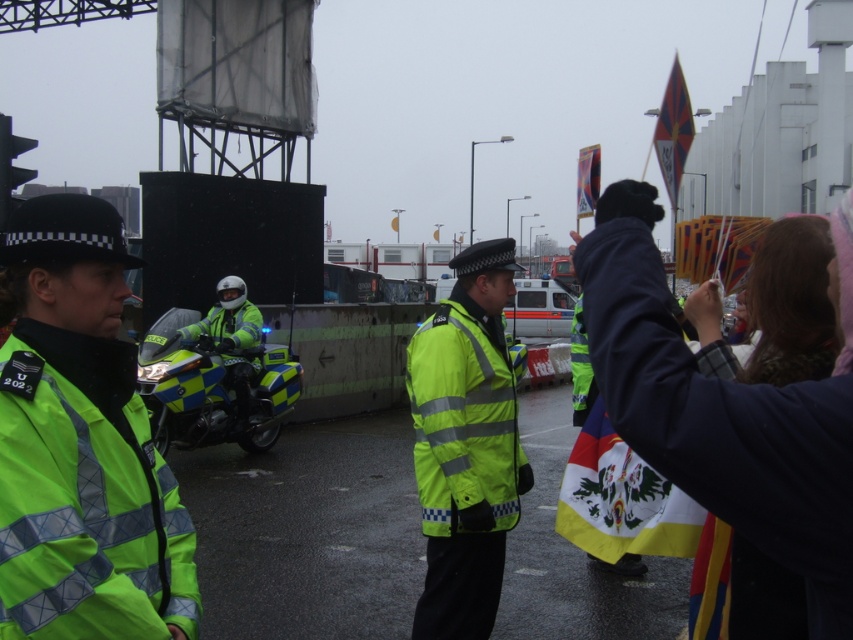
Question: Among these points, which one is nearest to the camera?

Choices:
 (A) pos(479,518)
 (B) pos(682,100)
 (C) pos(579,205)

Answer: (A)

Question: Among these objects, which one is farthest from the camera?

Choices:
 (A) neon yellow reflective jacket at center
 (B) high-visibility reflective jacket at center

Answer: (A)

Question: Can you confirm if neon yellow reflective jacket at left is positioned to the left of yellow fabric flag at upper right?

Choices:
 (A) no
 (B) yes

Answer: (B)

Question: Where is neon yellow reflective jacket at left located in relation to yellow fabric flag at upper center in the image?

Choices:
 (A) below
 (B) above

Answer: (A)

Question: Does dark blue fabric at upper right appear on the right side of neon yellow reflective jacket at center?

Choices:
 (A) no
 (B) yes

Answer: (B)

Question: Which object is farther from the camera taking this photo?

Choices:
 (A) yellow fabric flag at upper center
 (B) high-visibility reflective jacket at center
 (C) dark blue fabric at upper right

Answer: (A)